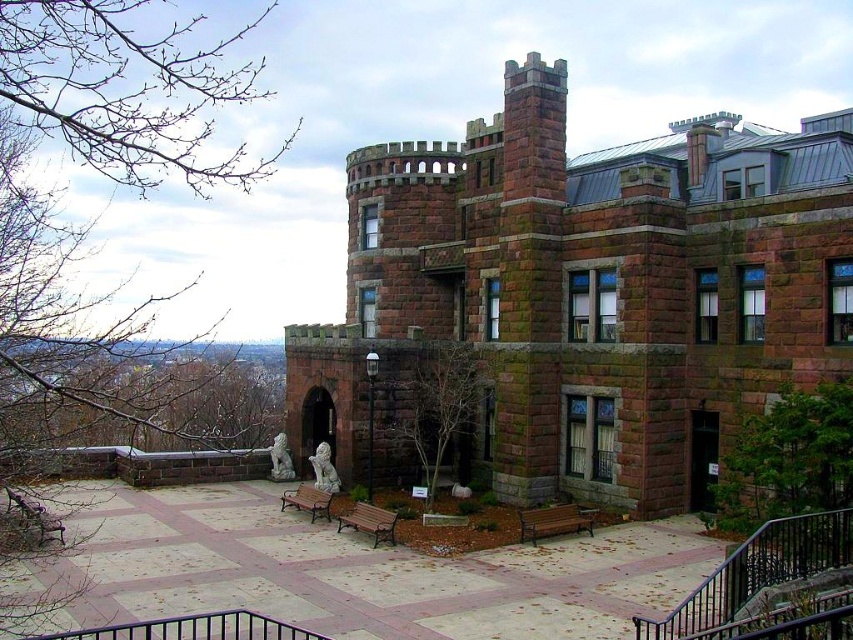
Question: Which object is the closest to the metallic polished bench at center?

Choices:
 (A) brown stone castle at center
 (B) brown wooden bench at lower center
 (C) brown wooden bench at center
 (D) wooden bench at lower left

Answer: (C)

Question: Which point is farther to the camera?

Choices:
 (A) brown wooden bench at lower center
 (B) brown stone castle at center
 (C) brown wooden bench at center
 (D) metallic polished bench at center

Answer: (D)

Question: Is brown stone castle at center bigger than brown wooden bench at center?

Choices:
 (A) no
 (B) yes

Answer: (B)

Question: Is brown stone castle at center in front of metallic polished bench at center?

Choices:
 (A) yes
 (B) no

Answer: (A)

Question: Does brown wooden bench at lower center appear on the left side of wooden bench at lower left?

Choices:
 (A) no
 (B) yes

Answer: (A)

Question: Which point is closer to the camera?

Choices:
 (A) brown stone castle at center
 (B) brown wooden bench at center
 (C) brown wooden bench at lower center
 (D) wooden bench at lower left

Answer: (D)